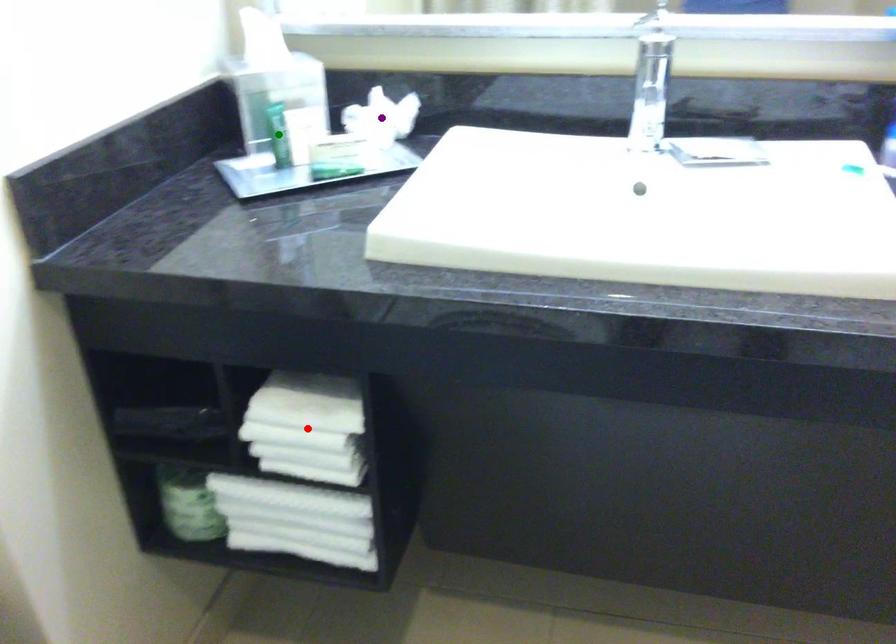
Order these from farthest to nearest:
A) purple point
B) green point
C) red point

purple point, green point, red point